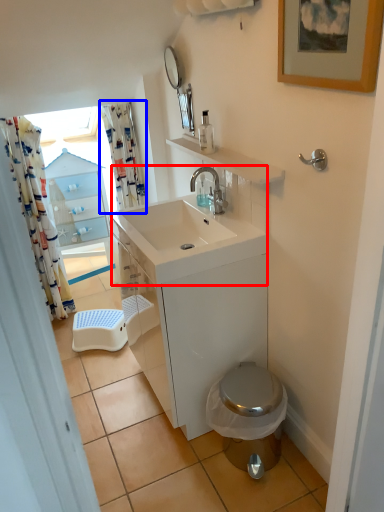
Question: Which object is closer to the camera taking this photo, sink (highlighted by a red box) or shower curtain (highlighted by a blue box)?

Choices:
 (A) sink
 (B) shower curtain

Answer: (A)